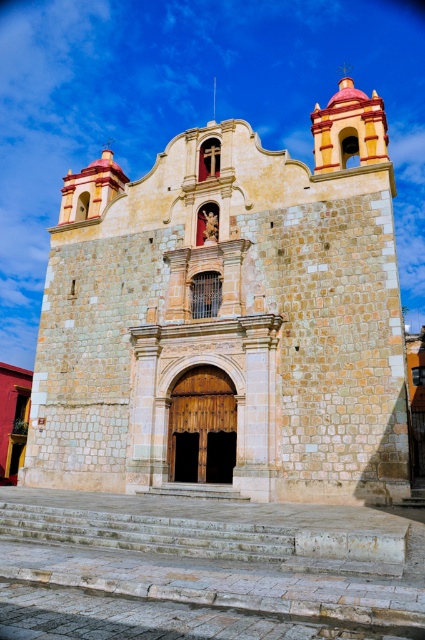
You are a visitor approaching the beige stone church at center and the stone steps at center. Which object will you encounter first as you move towards the church?

The stone steps at center will be encountered first since they are closer to the visitor than the beige stone church at center, which is further away.

You are a maintenance worker assigned to inspect the stone steps at center and the white stone stairs at center in front of the historic church. Which set of stairs has a higher elevation from the ground?

The stone steps at center has a greater height compared to white stone stairs at center, so the stone steps at center has a higher elevation from the ground.